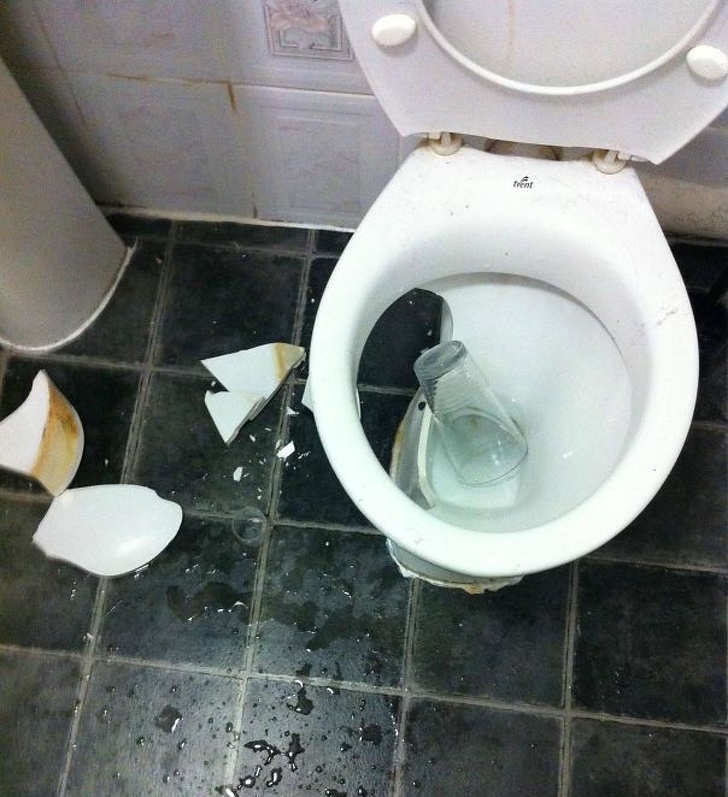
Identify the location of broken toilet bowl. (483, 339).